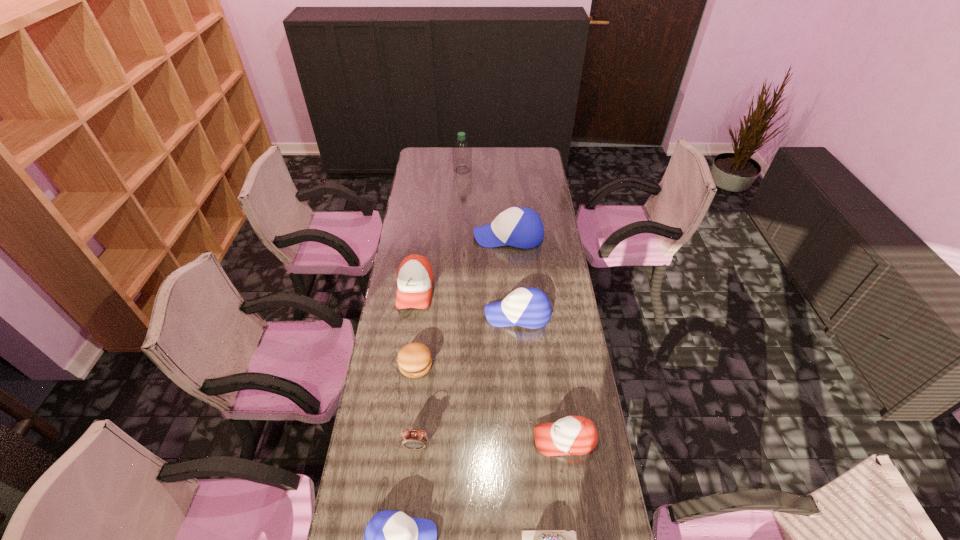
Where is `the farthest object`? The image size is (960, 540). the farthest object is located at coordinates (462, 153).

You are a GUI agent. You are given a task and a screenshot of the screen. Output one action in this format:
    pyautogui.click(x=<x>, y=<y>)
    Task: Click on the tallest object
    This screenshot has height=540, width=960.
    Given the screenshot: What is the action you would take?
    pyautogui.click(x=462, y=153)

You are a GUI agent. You are given a task and a screenshot of the screen. Output one action in this format:
    pyautogui.click(x=<x>, y=<y>)
    Task: Click on the farthest white baseball cap
    The height and width of the screenshot is (540, 960).
    Given the screenshot: What is the action you would take?
    point(520,227)

Find the location of a particular element. Image resolution: width=960 pixels, height=540 pixels. the biggest white baseball cap is located at coordinates (520, 227).

At what (x,y) coordinates should I click in order to perform the action: click on the bigger orange baseball cap. Please return your answer as a coordinate pair (x, y). The height and width of the screenshot is (540, 960). Looking at the image, I should click on (415, 278).

Identify the location of the farther orange baseball cap. This screenshot has width=960, height=540. (415, 278).

You are a GUI agent. You are given a task and a screenshot of the screen. Output one action in this format:
    pyautogui.click(x=<x>, y=<y>)
    Task: Click on the second biggest white baseball cap
    Image resolution: width=960 pixels, height=540 pixels.
    Given the screenshot: What is the action you would take?
    pyautogui.click(x=527, y=307)

Identify the location of alarm clock. The height and width of the screenshot is (540, 960). (413, 439).

The height and width of the screenshot is (540, 960). What are the coordinates of `the nearer orange baseball cap` in the screenshot? It's located at (573, 435).

The width and height of the screenshot is (960, 540). I want to click on the right orange baseball cap, so click(x=573, y=435).